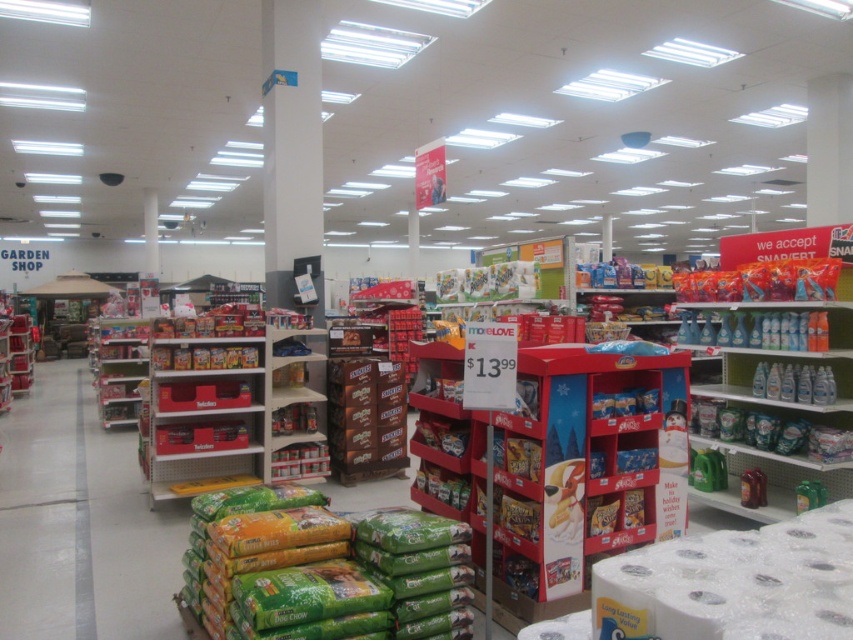
Question: Is white matte toilet paper at lower right thinner than clear plastic bottles at upper right?

Choices:
 (A) no
 (B) yes

Answer: (B)

Question: Which of the following is the closest to the observer?

Choices:
 (A) metallic gold snack at center
 (B) white matte toilet paper at lower right
 (C) green matte dog chow at lower center
 (D) white glossy aisle at center

Answer: (B)

Question: Among these points, which one is farthest from the camera?

Choices:
 (A) (54, 467)
 (B) (612, 616)

Answer: (A)

Question: Does green matte dog chow at lower center come behind white matte toilet paper at lower right?

Choices:
 (A) yes
 (B) no

Answer: (A)

Question: Does clear plastic bottles at upper right appear on the right side of metallic gold snack at center?

Choices:
 (A) no
 (B) yes

Answer: (B)

Question: Which point is closer to the camera?

Choices:
 (A) clear plastic bottles at upper right
 (B) white glossy aisle at center
 (C) white matte toilet paper at lower right
 (D) green matte dog chow at lower center

Answer: (C)